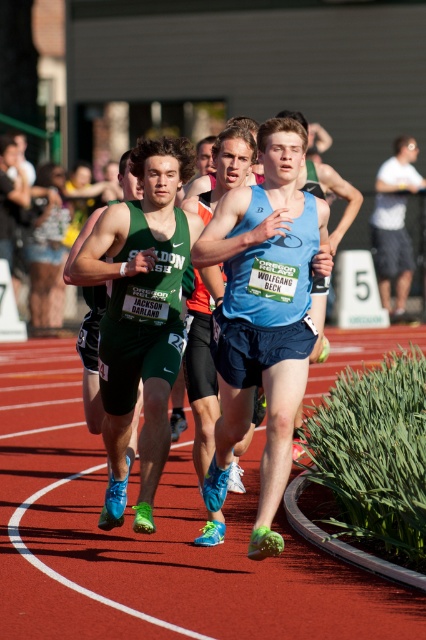
You are a race official at a track and field event. You need to determine if the distance between the red rubber track at center and the white cotton shirt at right is sufficient for a 100m sprinter to start their sprint. The sprinter requires at least 10 meters of clear space. Is the distance sufficient?

The distance between the red rubber track at center and the white cotton shirt at right is 8.39 meters, which is less than the required 10 meters. Therefore, the distance is insufficient for the sprinter to start their sprint.

You are a photographer at the track and field event. You want to capture a photo that includes both the green matte shorts at center and the white cotton shirt at right. Which object should you focus on to ensure both are in frame?

Since the green matte shorts at center occupies less space than the white cotton shirt at right, you should focus on the white cotton shirt at right to ensure both are in frame as it takes up more space and can help frame the composition.